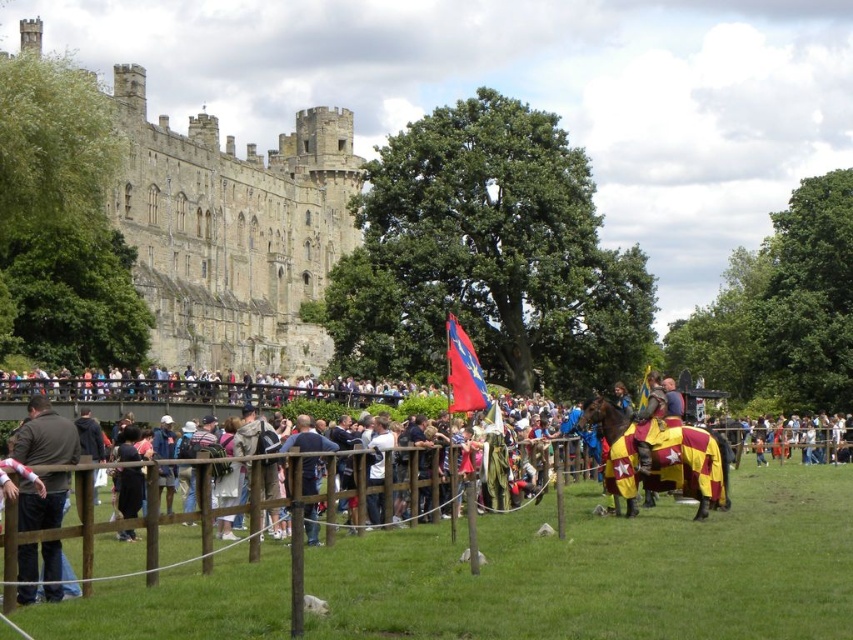
Does dark brown leather jacket at lower left have a larger size compared to blue denim jeans at center?

Yes.

Is dark brown leather jacket at lower left above blue denim jeans at center?

Indeed, dark brown leather jacket at lower left is positioned over blue denim jeans at center.

Does point (35, 522) come closer to viewer compared to point (287, 436)?

That is True.

Image resolution: width=853 pixels, height=640 pixels. I want to click on dark brown leather jacket at lower left, so click(x=45, y=436).

Which is more to the right, wooden fence at center or dark brown leather jacket at lower left?

wooden fence at center

Describe the element at coordinates (585, 570) in the screenshot. I see `wooden fence at center` at that location.

Identify the location of wooden fence at center. The width and height of the screenshot is (853, 640). (585, 570).

Does red satin flag at center have a greater width compared to blue denim jeans at center?

Incorrect, red satin flag at center's width does not surpass blue denim jeans at center's.

Which is in front, point (457, 326) or point (283, 444)?

Point (283, 444) is in front.

This screenshot has width=853, height=640. I want to click on red satin flag at center, so click(x=463, y=371).